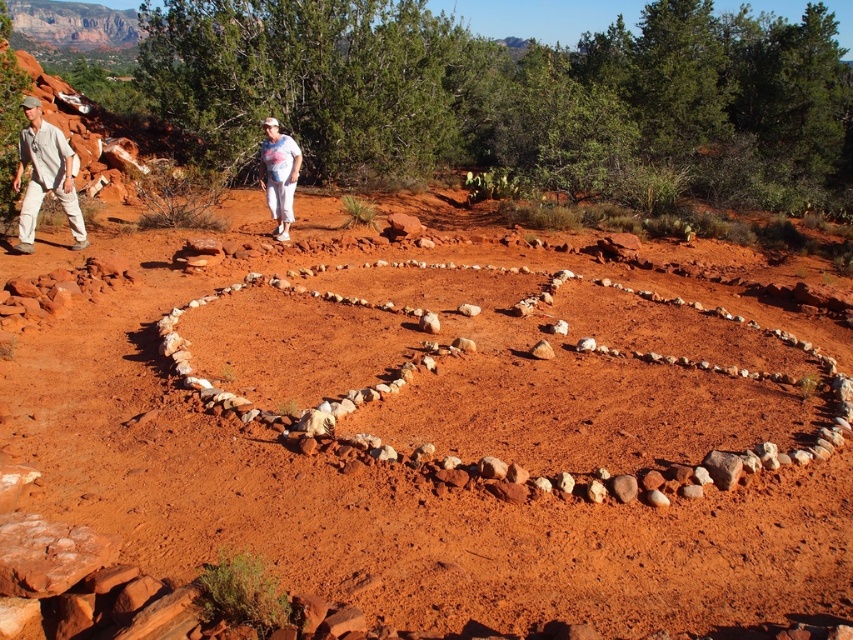
You are standing at the heart made of stones in the center of the desert scene. You see two points marked in the image. Which point is closer to you, point at coordinate [843,474] or point at coordinate [27,211]?

Point at coordinate [843,474] is closer to you than point at coordinate [27,211].